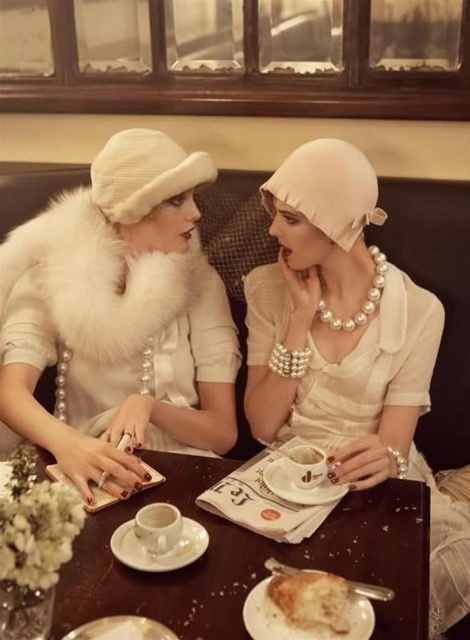
Is point (425, 472) more distant than point (346, 600)?

That is True.

Find the location of a particular element. The width and height of the screenshot is (470, 640). pearl white fabric dress at center is located at coordinates (369, 369).

Does wooden table at center have a lesser width compared to golden brown crusty bread at lower center?

In fact, wooden table at center might be wider than golden brown crusty bread at lower center.

Can you confirm if wooden table at center is positioned below golden brown crusty bread at lower center?

Actually, wooden table at center is above golden brown crusty bread at lower center.

Is point (181, 508) closer to camera compared to point (312, 609)?

No.

At what (x,y) coordinates should I click in order to perform the action: click on wooden table at center. Please return your answer as a coordinate pair (x, y). Looking at the image, I should click on (249, 557).

Can you confirm if white fur collar at center is positioned above wooden table at center?

Indeed, white fur collar at center is positioned over wooden table at center.

Does white fur collar at center come behind wooden table at center?

Yes, it is behind wooden table at center.

The image size is (470, 640). I want to click on white fur collar at center, so click(118, 316).